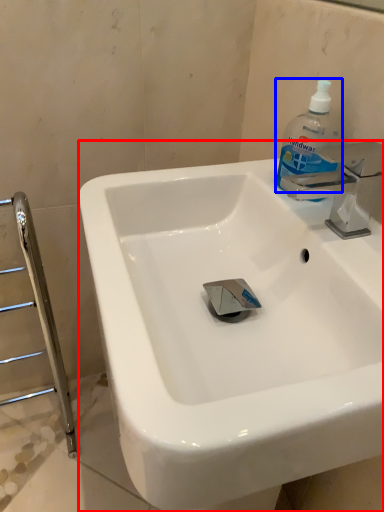
Question: Which object is further to the camera taking this photo, sink (highlighted by a red box) or cleaning product (highlighted by a blue box)?

Choices:
 (A) sink
 (B) cleaning product

Answer: (B)